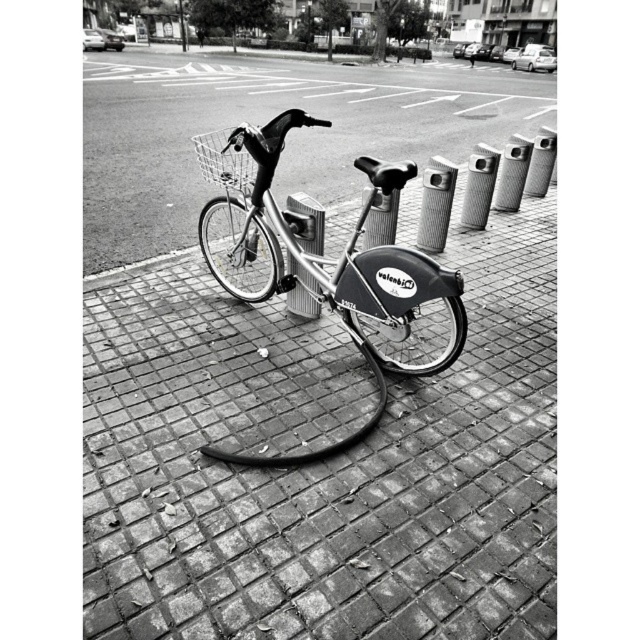
Question: Is brick pavement at center wider than metallic silver bicycle at center?

Choices:
 (A) no
 (B) yes

Answer: (B)

Question: Which point is farther from the camera taking this photo?

Choices:
 (A) (428, 280)
 (B) (211, 138)
 (C) (230, 483)

Answer: (B)

Question: In this image, where is brick pavement at center located relative to metallic silver bicycle at center?

Choices:
 (A) right
 (B) left

Answer: (A)

Question: Which point appears closest to the camera in this image?

Choices:
 (A) (384, 397)
 (B) (250, 157)
 (C) (113, 396)

Answer: (C)

Question: Which point is closer to the camera taking this photo?

Choices:
 (A) (388, 184)
 (B) (234, 445)
 (C) (241, 161)

Answer: (B)

Question: Does metallic silver bicycle at center have a lesser width compared to metallic wire basket at center?

Choices:
 (A) no
 (B) yes

Answer: (A)